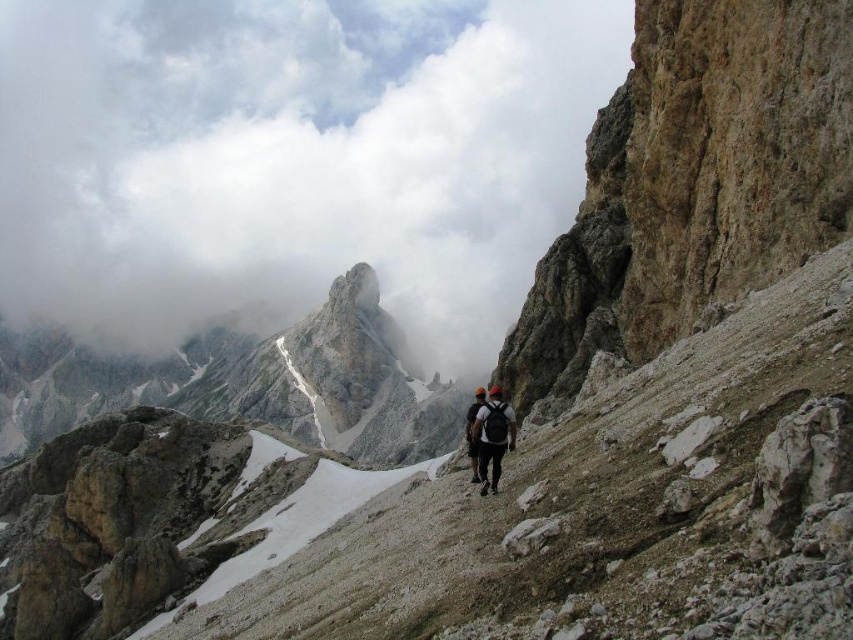
Who is more forward, (88,316) or (503,401)?

Point (503,401)

Locate an element on the screen. The height and width of the screenshot is (640, 853). white fluffy cloud at upper center is located at coordinates (292, 160).

Does white fluffy cloud at upper center have a larger size compared to black fabric backpack at center?

Yes, white fluffy cloud at upper center is bigger than black fabric backpack at center.

Between white fluffy cloud at upper center and black fabric backpack at center, which one appears on the left side from the viewer's perspective?

Positioned to the left is white fluffy cloud at upper center.

Find the location of a particular element. This screenshot has width=853, height=640. white fluffy cloud at upper center is located at coordinates pos(292,160).

Can you confirm if dark gray backpack at center is positioned above black fabric backpack at center?

Yes, dark gray backpack at center is above black fabric backpack at center.

Between point (474, 435) and point (477, 470), which one is positioned behind?

The point (474, 435) is behind.

Who is more distant from viewer, [497,484] or [468,435]?

The point [468,435] is more distant.

Locate an element on the screen. This screenshot has width=853, height=640. dark gray backpack at center is located at coordinates (492, 436).